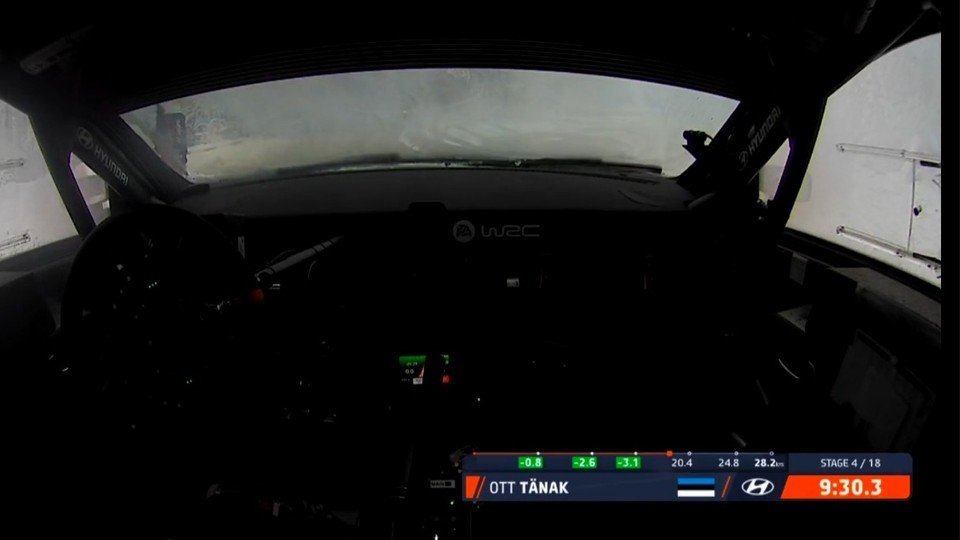
Locate an element on the screen. The height and width of the screenshot is (540, 960). windows is located at coordinates (27, 208), (81, 172), (777, 167), (858, 200).